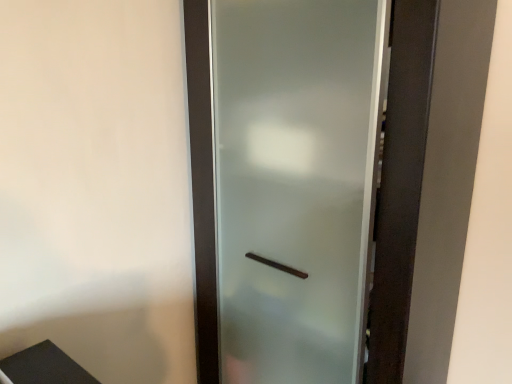
At what (x,y) coordinates should I click in order to perform the action: click on frosted glass door at center. Please return your answer as a coordinate pair (x, y). Looking at the image, I should click on (284, 184).

Describe the element at coordinates (284, 184) in the screenshot. I see `frosted glass door at center` at that location.

You are a GUI agent. You are given a task and a screenshot of the screen. Output one action in this format:
    pyautogui.click(x=<x>, y=<y>)
    Task: Click on the frosted glass door at center
    The height and width of the screenshot is (384, 512).
    Given the screenshot: What is the action you would take?
    pyautogui.click(x=284, y=184)